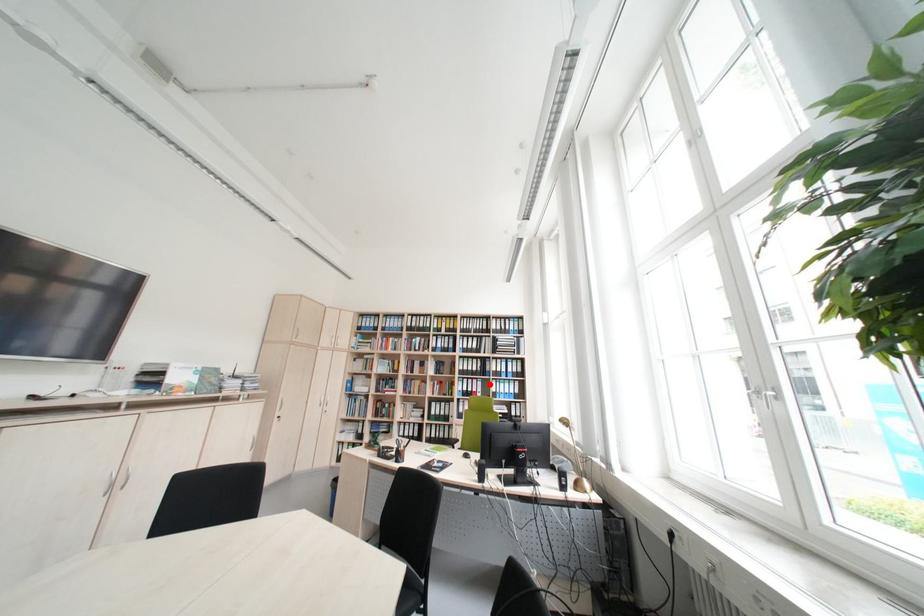
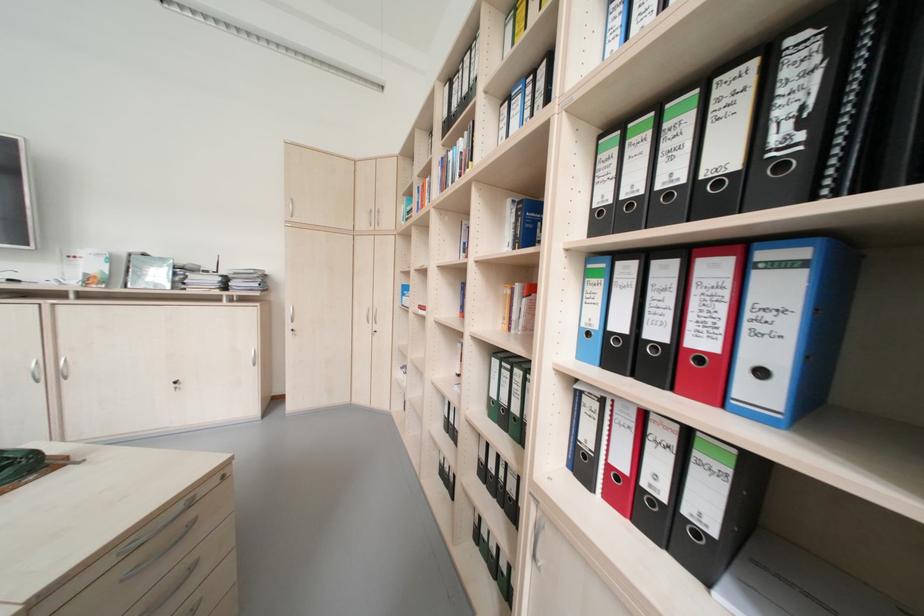
Question: I am providing you with two images of the same scene from different viewpoints. Image1 has a red point marked. In image2, the corresponding 3D location appears at what relative position? Reply with the corresponding letter.

Choices:
 (A) Closer
 (B) Farther

Answer: (A)